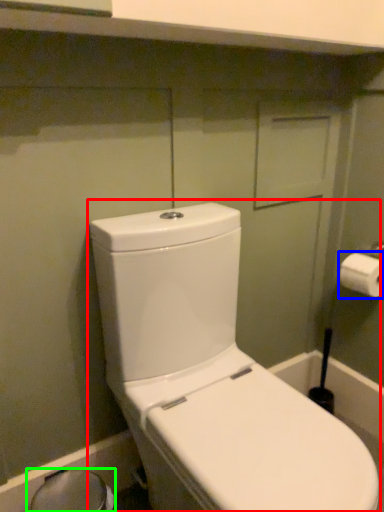
Question: Estimate the real-world distances between objects in this image. Which object is closer to toilet (highlighted by a red box), toilet paper (highlighted by a blue box) or bidet (highlighted by a green box)?

Choices:
 (A) toilet paper
 (B) bidet

Answer: (B)